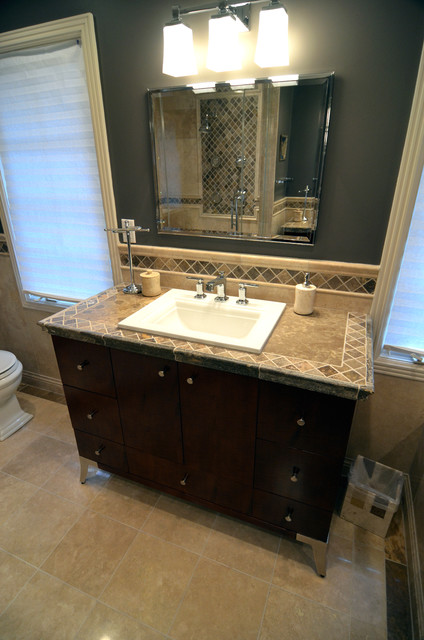
Locate what you push to get the soap to come out in the image. Your answer should be formatted as a list of tuples, i.e. [(x1, y1), (x2, y2), ...], where each tuple contains the x and y coordinates of a point satisfying the conditions above.

[(305, 274)]